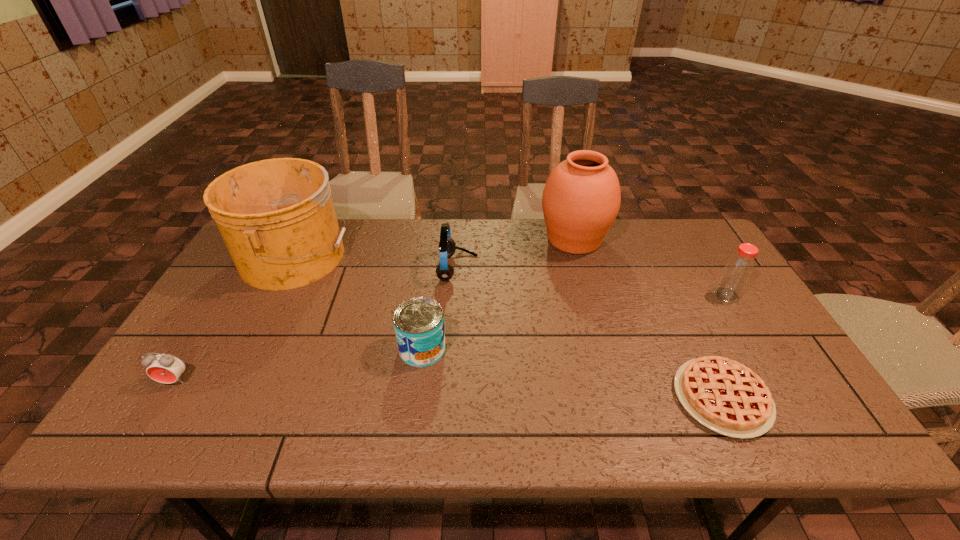
The height and width of the screenshot is (540, 960). In order to click on alarm clock situated at the left edge in this screenshot , I will do `click(165, 368)`.

Image resolution: width=960 pixels, height=540 pixels. What are the coordinates of `bottle at the right edge` in the screenshot? It's located at (738, 270).

Find the location of `pie present at the right edge`. pie present at the right edge is located at coordinates (727, 397).

This screenshot has height=540, width=960. Find the location of `object at the far left corner`. object at the far left corner is located at coordinates (276, 216).

You are a GUI agent. You are given a task and a screenshot of the screen. Output one action in this format:
    pyautogui.click(x=<x>, y=<y>)
    Task: Click on the object located in the near right corner section of the desktop
    The image size is (960, 540).
    Given the screenshot: What is the action you would take?
    pyautogui.click(x=727, y=397)

I want to click on free space at the far edge of the desktop, so click(x=519, y=229).

Where is `free point at the near edge`? The image size is (960, 540). free point at the near edge is located at coordinates pyautogui.click(x=310, y=424).

In the image, there is a desktop. Identify the location of free space at the left edge. Image resolution: width=960 pixels, height=540 pixels. 191,332.

The height and width of the screenshot is (540, 960). Identify the location of vacant area at the far right corner. (713, 253).

The image size is (960, 540). What are the coordinates of `free location at the near right corner` in the screenshot? It's located at (776, 422).